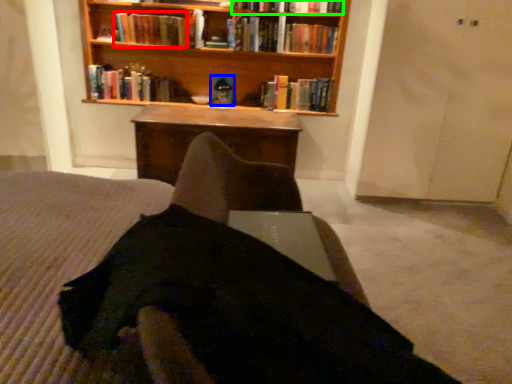
Question: Estimate the real-world distances between objects in this image. Which object is farther from book (highlighted by a red box), book (highlighted by a blue box) or book (highlighted by a green box)?

Choices:
 (A) book
 (B) book

Answer: (B)